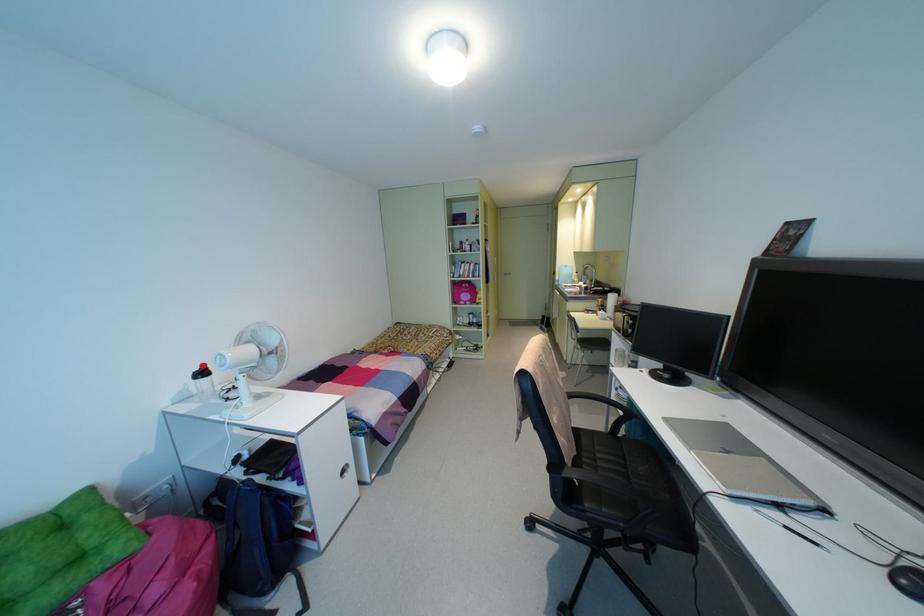
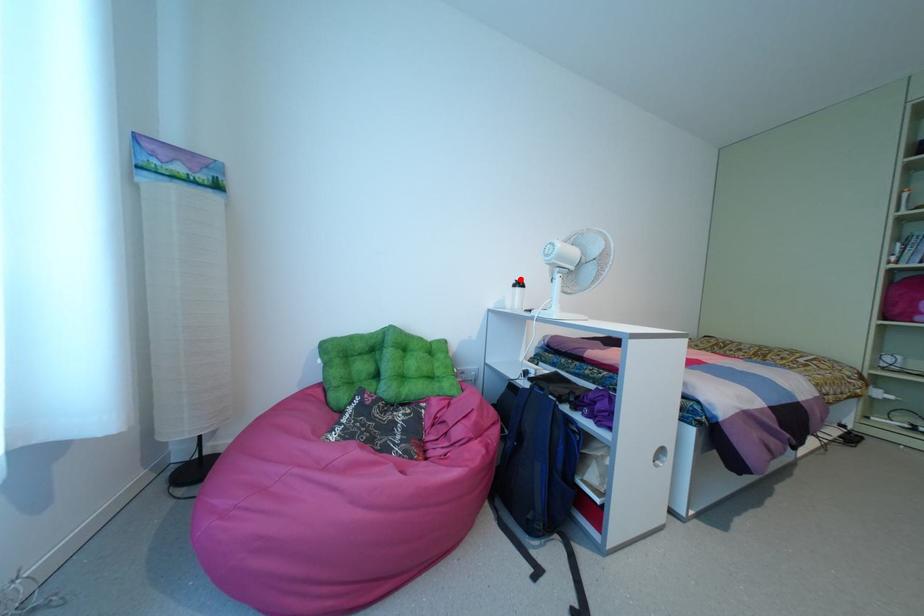
I am providing you with two images of the same scene from different viewpoints. A red point is marked on the first image and another point is marked on the second image. Does the point marked in image1 correspond to the same location as the one in image2?

Yes